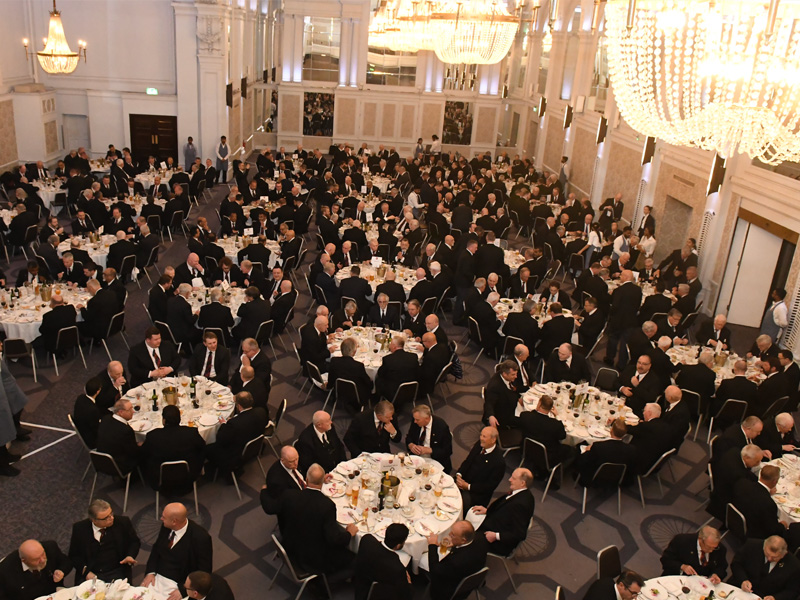
The image size is (800, 600). Identify the location of door. (768, 276).